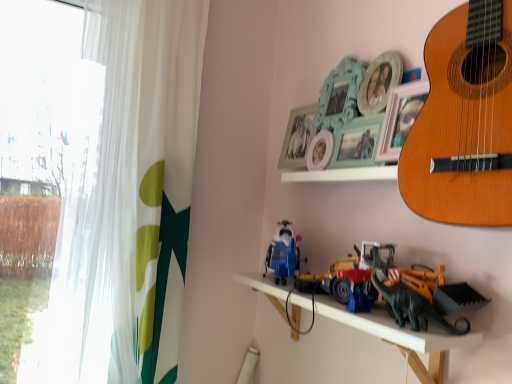
Locate an element on the screen. Image resolution: width=512 pixels, height=384 pixels. vacant area situated below blue plastic toy truck at center, the first toy positioned from the left (from a real-world perspective) is located at coordinates (276, 285).